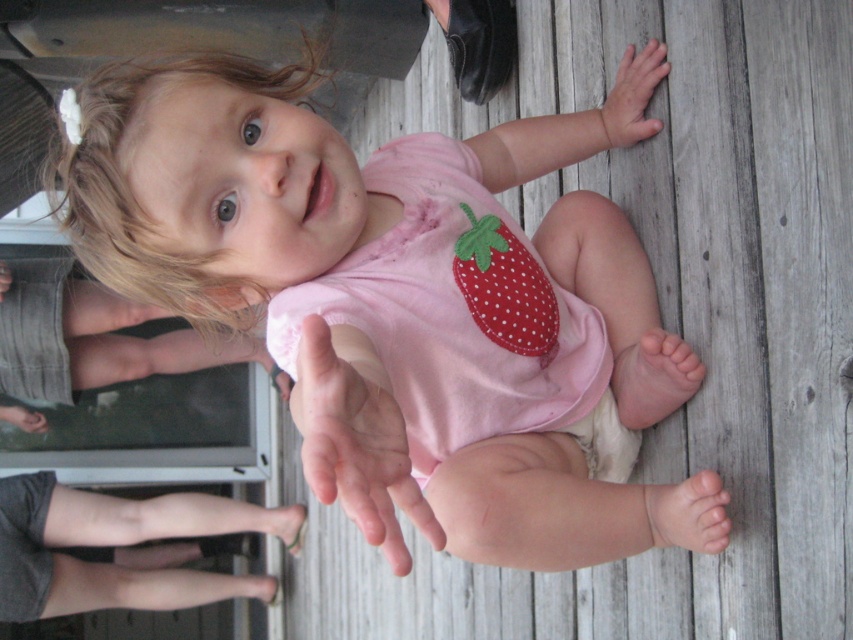
You are a photographer trying to capture the child reaching for the red dotted fabric strawberry at center. The smooth wooden hand at upper right is in the way. Can you adjust your position to avoid it?

The red dotted fabric strawberry at center is located below the smooth wooden hand at upper right, so moving the camera downward slightly would allow you to capture the strawberry without the wooden hand obstructing the view.

You are a photographer trying to capture the child in the scene. You need to ensure the pink smooth hand at center and the pink fabric diaper at lower left are both visible in the frame. Based on their positions, which object should be placed closer to the left side of the photo?

The pink fabric diaper at lower left should be placed closer to the left side of the photo because the pink smooth hand at center is to the right of it.

You are a photographer trying to capture the child in the scene. Since the pink smooth hand at center and the pink fabric diaper at lower left are both in the frame, which one should you focus on to ensure the subject is clearly visible?

The pink smooth hand at center should be focused on because it occupies less space than the pink fabric diaper at lower left, making it a more precise subject for clear visibility.